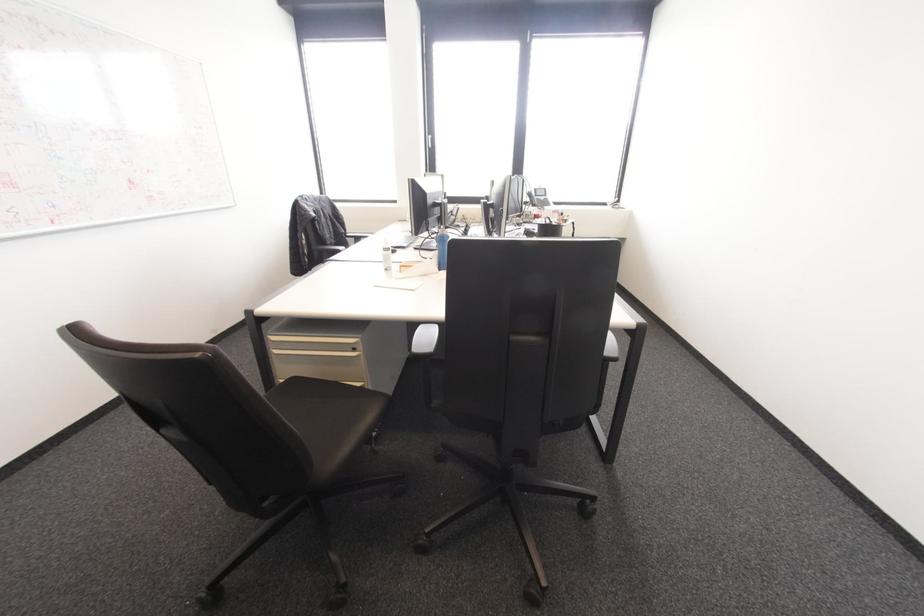
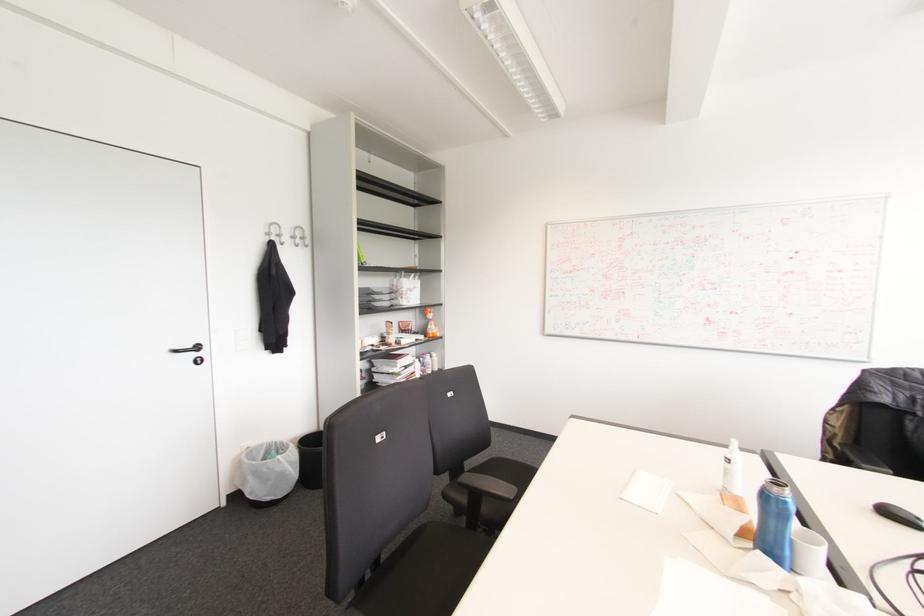
Question: I am providing you with two images of the same scene from different viewpoints. Which of the following objects are not visible in image2?

Choices:
 (A) black trash can
 (B) black garment bag
 (C) white coffee mug
 (D) blue water bottle

Answer: (D)